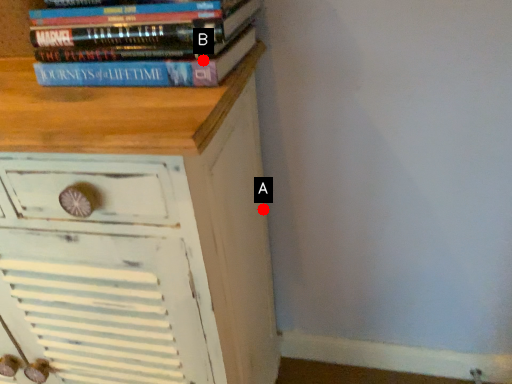
Question: Two points are circled on the image, labeled by A and B beside each circle. Which point is closer to the camera taking this photo?

Choices:
 (A) A is closer
 (B) B is closer

Answer: (B)